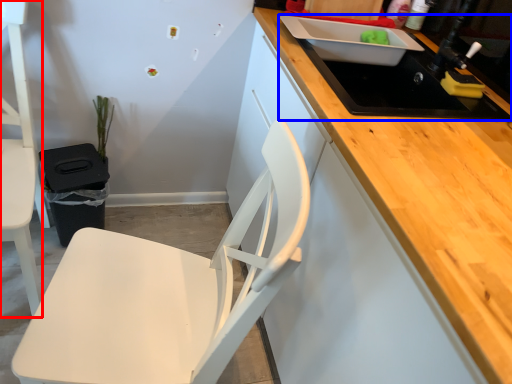
Question: Among these objects, which one is nearest to the camera, chair (highlighted by a red box) or sink (highlighted by a blue box)?

Choices:
 (A) chair
 (B) sink

Answer: (A)